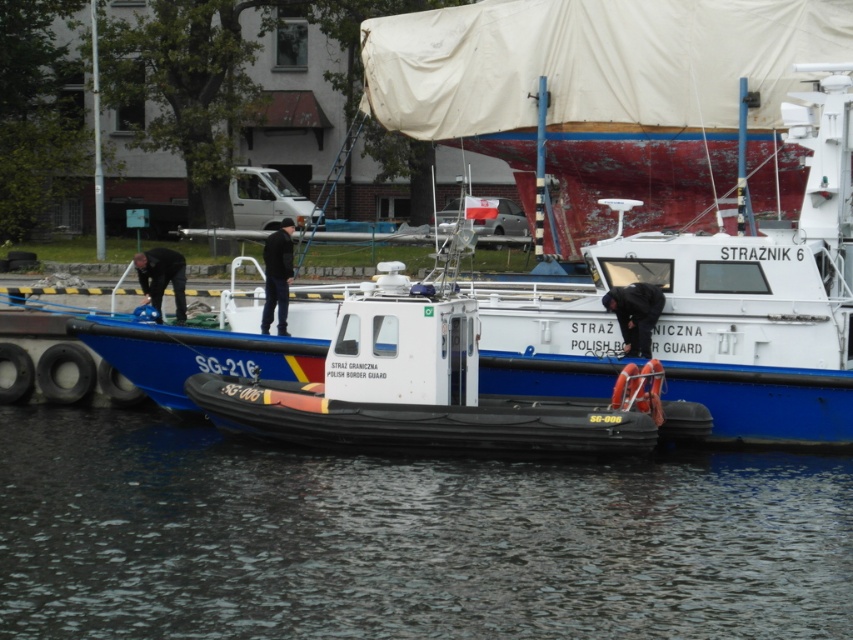
You are standing on the dock and see the white rubber boat at center and the black matte jacket at center. Which object is positioned to the right when viewed from your perspective?

The white rubber boat at center is positioned to the right of the black matte jacket at center.